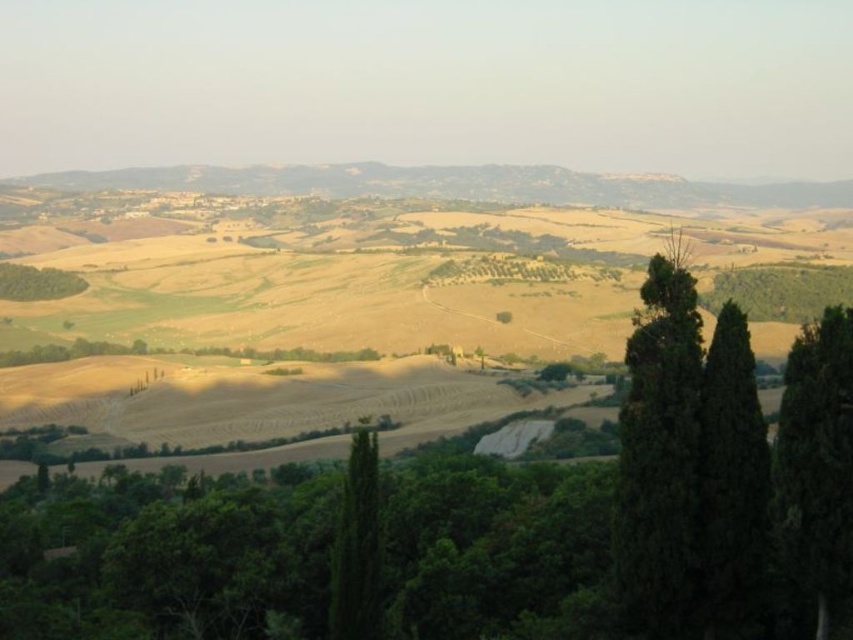
You are planning to plant a new tree in this landscape. The green textured tree at center right has a narrower width compared to the green leafy tree at lower left. Considering their sizes, which tree would require more space between it and neighboring plants to avoid overcrowding?

The green leafy tree at lower left requires more space between it and neighboring plants because its width is greater than the green textured tree at center right.

You are standing at the starting point in the image and see two points marked. Which point is closer to you, point (334, 634) or point (28, 288)?

Point (334, 634) is in front of point (28, 288), so it is closer to you.